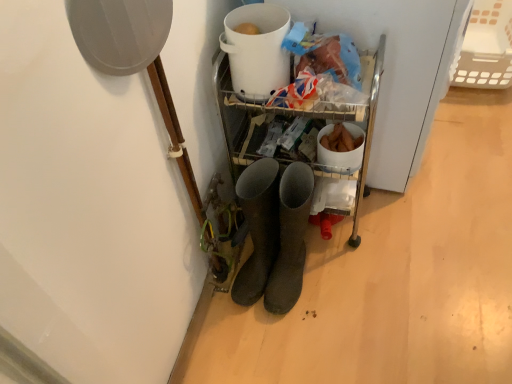
Image resolution: width=512 pixels, height=384 pixels. What are the coordinates of `vacant region under dark gray rubber boots at center (from a real-world perspective)` in the screenshot? It's located at (297, 292).